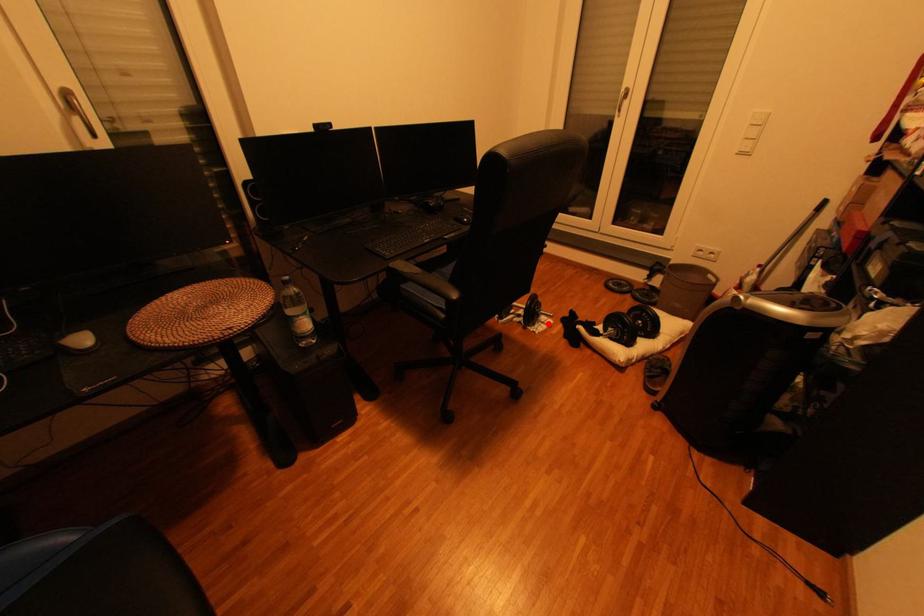
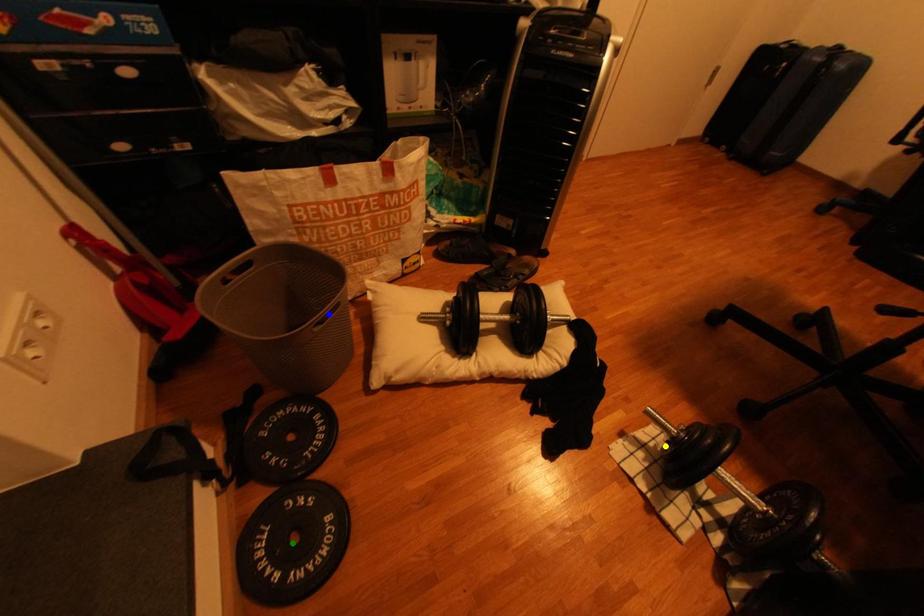
Question: I am providing you with two images of the same scene from different viewpoints. A red point is marked on the first image. You are given multiple points on the second image. Which mark in image 2 goes with the point in image 1?

Choices:
 (A) green point
 (B) blue point
 (C) yellow point

Answer: (C)